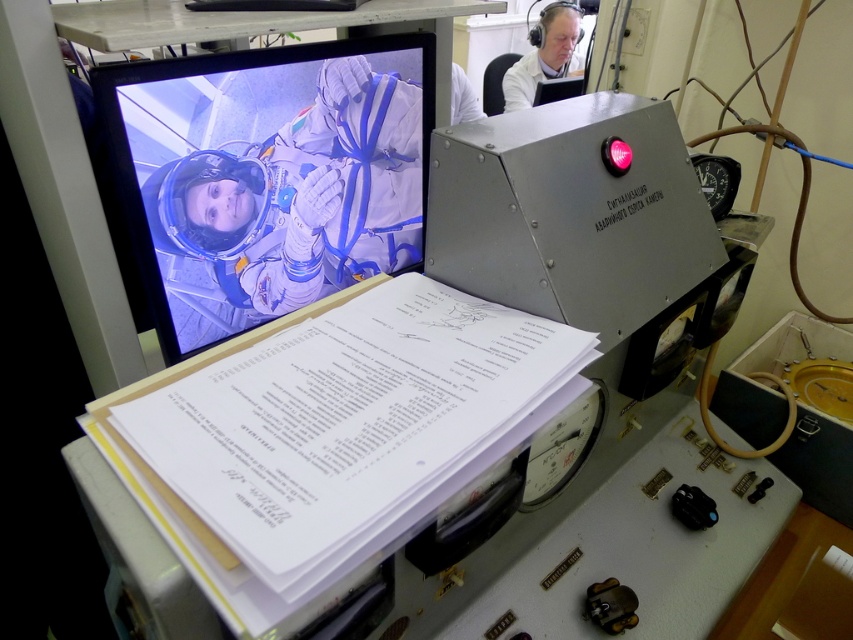
You are an engineer in the control room and need to check the astronaut status. You see the shiny plastic monitor at upper left and the white lab coat at upper right. Which object is located to the left of the other?

The shiny plastic monitor at upper left is positioned on the left side of white lab coat at upper right.

In the scene shown: You are an astronaut in the spacecraft and you need to reach a control panel located at point (521, 56). There is an obstacle at point (273, 154). Will you be able to reach the control panel without going around the obstacle?

Point (273, 154) is in front of point (521, 56), so the obstacle is blocking the path to the control panel. You will need to go around it.

You are an engineer in the control room. You need to check the astronaut status on the shiny plastic monitor at upper left and also locate the white lab coat at upper right. Which object is positioned lower in the scene?

The shiny plastic monitor at upper left is positioned below the white lab coat at upper right, so the monitor is lower.